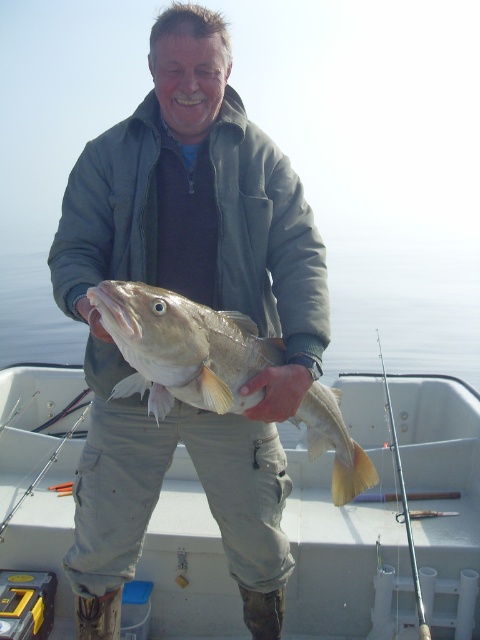
You are an angler who just caught a shiny silver fish at center and has a silver metallic fishing pole at right. Which object is wider when looking at their widths?

The shiny silver fish at center is wider than the silver metallic fishing pole at right according to the description.